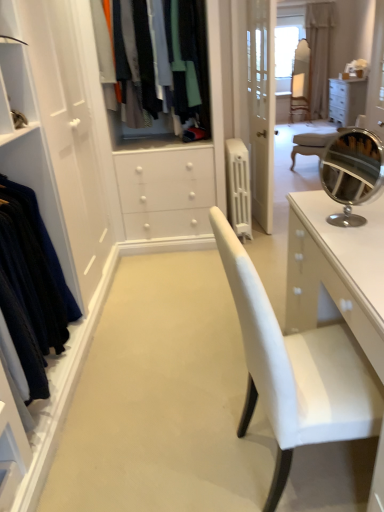
Question: Is matte fabric clothes at center, the first clothing viewed from the right, taller than light beige fabric armchair at center?

Choices:
 (A) yes
 (B) no

Answer: (B)

Question: From the image's perspective, does matte fabric clothes at center, the first clothing viewed from the right, appear lower than light beige fabric armchair at center?

Choices:
 (A) no
 (B) yes

Answer: (B)

Question: Considering the relative sizes of matte fabric clothes at center, the second clothing from the front, and light beige fabric armchair at center in the image provided, is matte fabric clothes at center, the second clothing from the front, thinner than light beige fabric armchair at center?

Choices:
 (A) yes
 (B) no

Answer: (B)

Question: Is matte fabric clothes at center, which appears as the 2th clothing when viewed from the left, positioned in front of light beige fabric armchair at center?

Choices:
 (A) yes
 (B) no

Answer: (A)

Question: From a real-world perspective, is matte fabric clothes at center, the first clothing viewed from the right, on top of light beige fabric armchair at center?

Choices:
 (A) yes
 (B) no

Answer: (A)

Question: Considering the positions of point (228, 146) and point (307, 82), is point (228, 146) closer or farther from the camera than point (307, 82)?

Choices:
 (A) closer
 (B) farther

Answer: (A)

Question: Considering the positions of white plastic radiator at center and light beige fabric armchair at center in the image, is white plastic radiator at center taller or shorter than light beige fabric armchair at center?

Choices:
 (A) short
 (B) tall

Answer: (A)

Question: Is white plastic radiator at center to the left or to the right of light beige fabric armchair at center in the image?

Choices:
 (A) right
 (B) left

Answer: (B)

Question: From a real-world perspective, is white plastic radiator at center positioned above or below light beige fabric armchair at center?

Choices:
 (A) above
 (B) below

Answer: (B)

Question: Considering the positions of point (309, 92) and point (8, 182), is point (309, 92) closer or farther from the camera than point (8, 182)?

Choices:
 (A) farther
 (B) closer

Answer: (A)

Question: Which is correct: light beige fabric armchair at center is inside velvet dark blue dress at left, which is counted as the 1th clothing, starting from the front, or outside of it?

Choices:
 (A) outside
 (B) inside

Answer: (A)

Question: From a real-world perspective, is light beige fabric armchair at center above or below velvet dark blue dress at left, which is the 1th clothing from bottom to top?

Choices:
 (A) above
 (B) below

Answer: (A)

Question: From their relative heights in the image, would you say light beige fabric armchair at center is taller or shorter than velvet dark blue dress at left, the 1th clothing when ordered from left to right?

Choices:
 (A) tall
 (B) short

Answer: (A)

Question: Would you say white plastic radiator at center is to the left or to the right of velvet dark blue dress at left, the 2th clothing in the top-to-bottom sequence, in the picture?

Choices:
 (A) left
 (B) right

Answer: (B)

Question: Considering the positions of white plastic radiator at center and velvet dark blue dress at left, the second clothing when ordered from back to front, in the image, is white plastic radiator at center wider or thinner than velvet dark blue dress at left, the second clothing when ordered from back to front,?

Choices:
 (A) wide
 (B) thin

Answer: (A)